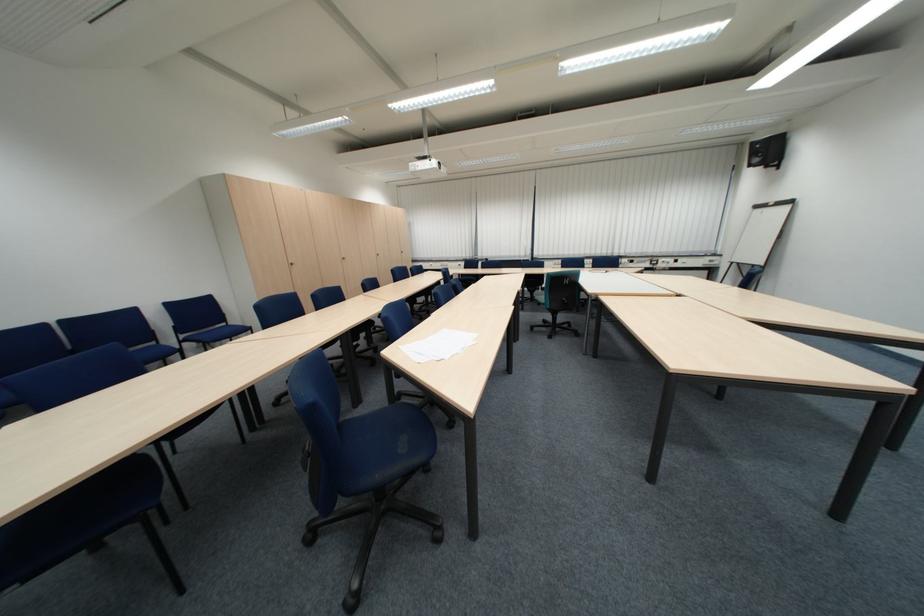
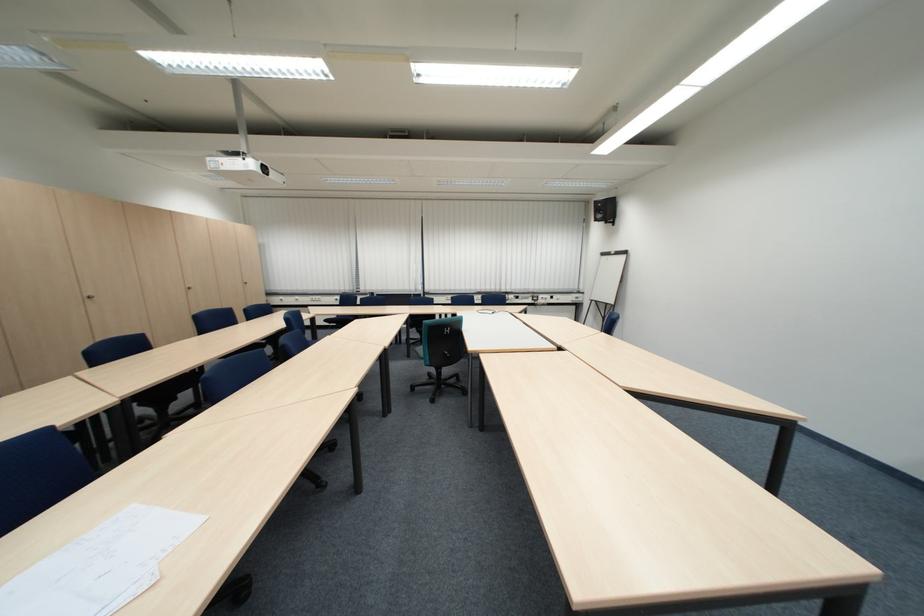
Question: The first image is from the beginning of the video and the second image is from the end. How did the camera likely rotate when shooting the video?

Choices:
 (A) Left
 (B) Right
 (C) Up
 (D) Down

Answer: (B)